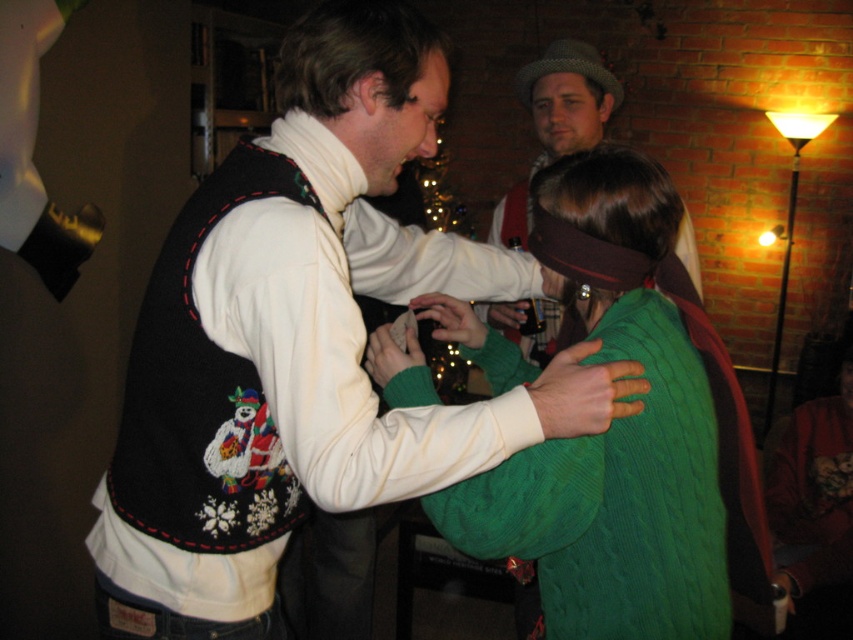
You are a photographer trying to capture a candid shot of the two objects mentioned. Given that your camera has a maximum focus range of 20 inches, can you focus on both the white sweater vest with snowman design at center and the knitted wool hat at upper center simultaneously?

The distance between the white sweater vest with snowman design at center and the knitted wool hat at upper center is 20.03 inches, which exceeds the camera maximum focus range of 20 inches. Therefore, you cannot focus on both simultaneously.